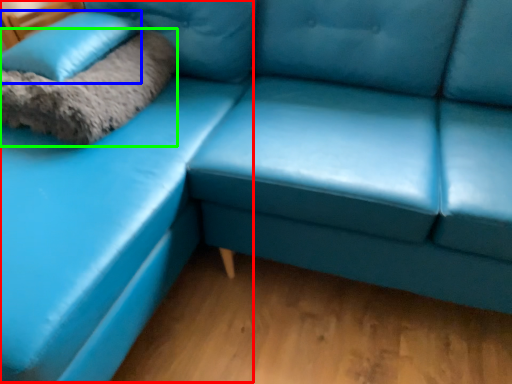
Question: Which object is the closest to the couch (highlighted by a red box)? Choose among these: pillow (highlighted by a blue box) or blanket (highlighted by a green box).

Choices:
 (A) pillow
 (B) blanket

Answer: (B)